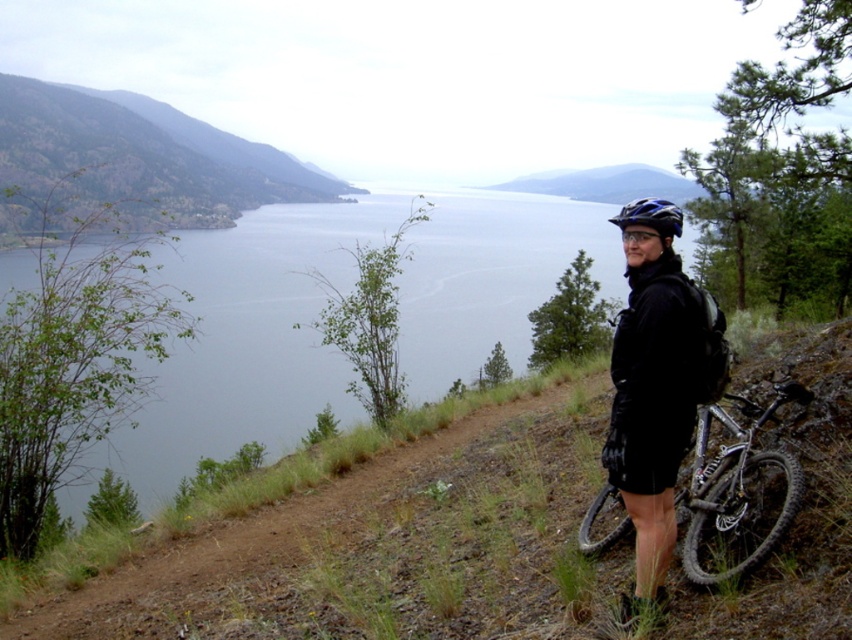
Who is lower down, green leafy hillside at left or black matte jacket at right?

black matte jacket at right is lower down.

Who is shorter, green leafy hillside at left or black matte jacket at right?

black matte jacket at right is shorter.

In the scene shown: Who is more forward, [66,88] or [722,349]?

Point [722,349] is more forward.

Find the location of a particular element. green leafy hillside at left is located at coordinates click(142, 154).

Does green leafy hillside at left have a lesser height compared to silver metallic bicycle at lower right?

No.

Can you confirm if green leafy hillside at left is wider than silver metallic bicycle at lower right?

Indeed, green leafy hillside at left has a greater width compared to silver metallic bicycle at lower right.

Between point (150, 182) and point (780, 516), which one is positioned behind?

The point (150, 182) is more distant.

Where is `green leafy hillside at left`? This screenshot has width=852, height=640. green leafy hillside at left is located at coordinates (142, 154).

Who is positioned more to the right, black matte jacket at right or silver metallic bicycle at lower right?

Positioned to the right is silver metallic bicycle at lower right.

Is point (676, 445) positioned before point (694, 458)?

Yes, point (676, 445) is closer to viewer.

Describe the element at coordinates (657, 385) in the screenshot. I see `black matte jacket at right` at that location.

Locate an element on the screen. black matte jacket at right is located at coordinates (657, 385).